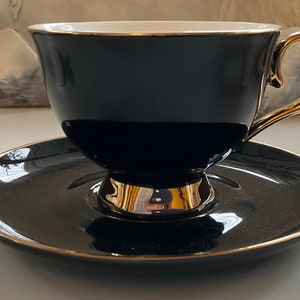
Find the location of a particular element. This screenshot has height=300, width=300. handle is located at coordinates (275, 120).